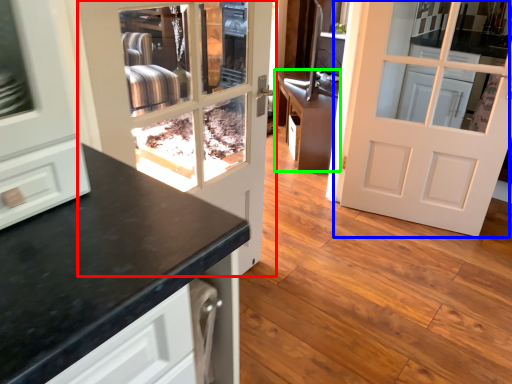
Question: Estimate the real-world distances between objects in this image. Which object is farther from door (highlighted by a red box), door (highlighted by a blue box) or cabinetry (highlighted by a green box)?

Choices:
 (A) door
 (B) cabinetry

Answer: (A)